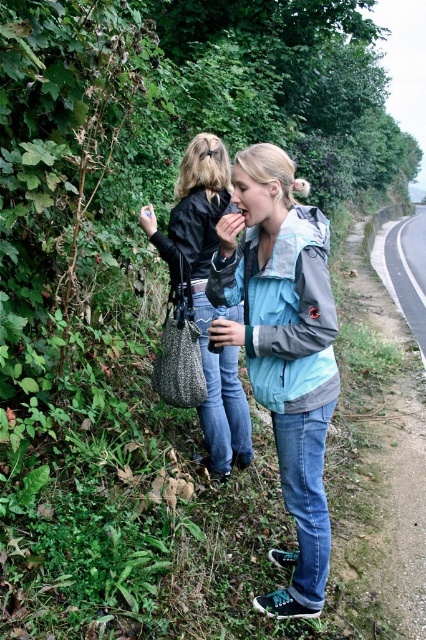
Question: Can you confirm if light blue fabric jacket at center is positioned to the right of leather jacket at center?

Choices:
 (A) yes
 (B) no

Answer: (A)

Question: Can you confirm if light blue fabric jacket at center is positioned above leather jacket at center?

Choices:
 (A) yes
 (B) no

Answer: (B)

Question: Is light blue fabric jacket at center wider than leather jacket at center?

Choices:
 (A) no
 (B) yes

Answer: (A)

Question: Which point is closer to the camera?

Choices:
 (A) (201, 170)
 (B) (313, 264)

Answer: (B)